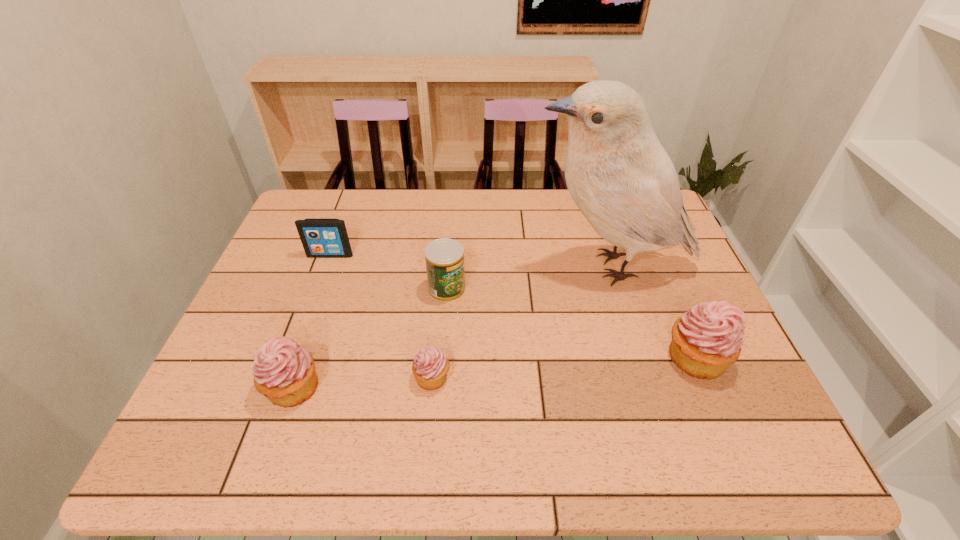
Find the location of a particular element. The width and height of the screenshot is (960, 540). blank space located on the front screen of the iPod is located at coordinates (306, 319).

Locate an element on the screen. This screenshot has width=960, height=540. free location located 0.120m on the left of the can is located at coordinates (384, 289).

Locate an element on the screen. Image resolution: width=960 pixels, height=540 pixels. vacant space located on the face of the parakeet is located at coordinates (401, 267).

Find the location of `vacant area situated on the face of the parakeet`. vacant area situated on the face of the parakeet is located at coordinates (433, 267).

Where is `vacant area situated on the face of the parakeet`? This screenshot has width=960, height=540. vacant area situated on the face of the parakeet is located at coordinates [479, 267].

At what (x,y) coordinates should I click in order to perform the action: click on cupcake at the left edge. Please return your answer as a coordinate pair (x, y). This screenshot has height=540, width=960. Looking at the image, I should click on (284, 372).

Where is `iPod at the left edge`? The width and height of the screenshot is (960, 540). iPod at the left edge is located at coordinates (x=321, y=238).

At what (x,y) coordinates should I click in order to perform the action: click on cupcake located at the right edge. Please return your answer as a coordinate pair (x, y). The height and width of the screenshot is (540, 960). Looking at the image, I should click on tap(708, 338).

Find the location of a particular element. This screenshot has height=540, width=960. parakeet situated at the right edge is located at coordinates (619, 175).

I want to click on object that is positioned at the near left corner, so pos(284,372).